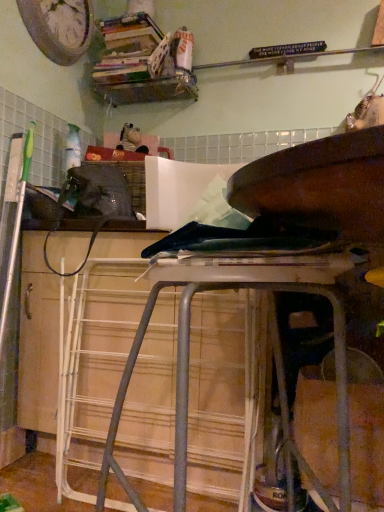
You are a GUI agent. You are given a task and a screenshot of the screen. Output one action in this format:
    pyautogui.click(x=<x>, y=<y>)
    Task: Click on the metallic silver stool at center
    The height and width of the screenshot is (512, 384).
    Given the screenshot: What is the action you would take?
    pyautogui.click(x=273, y=264)

What do you see at coordinates (143, 63) in the screenshot? I see `wooden bookshelf at upper center` at bounding box center [143, 63].

What do you see at coordinates (59, 27) in the screenshot?
I see `wooden clock at upper left` at bounding box center [59, 27].

Where is `metallic silver stool at center`? Image resolution: width=384 pixels, height=512 pixels. metallic silver stool at center is located at coordinates (273, 264).

Considering the sizes of objects wooden bookshelf at upper center and metallic silver stool at center in the image provided, who is taller, wooden bookshelf at upper center or metallic silver stool at center?

Standing taller between the two is metallic silver stool at center.

How far apart are wooden bookshelf at upper center and metallic silver stool at center?

1.33 meters.

Is the depth of wooden bookshelf at upper center less than that of metallic silver stool at center?

No, it is not.

From the image's perspective, is wooden bookshelf at upper center beneath metallic silver stool at center?

No, from the image's perspective, wooden bookshelf at upper center is not below metallic silver stool at center.

Which is closer to the camera, (60, 31) or (159, 282)?

Point (60, 31).

How different are the orientations of wooden clock at upper left and metallic silver stool at center in degrees?

The facing directions of wooden clock at upper left and metallic silver stool at center are 89.6 degrees apart.

From the image's perspective, is wooden clock at upper left under metallic silver stool at center?

Actually, wooden clock at upper left appears above metallic silver stool at center in the image.

Where is `shelf that appears behind the wooden clock at upper left`? Image resolution: width=384 pixels, height=512 pixels. shelf that appears behind the wooden clock at upper left is located at coordinates (143, 63).

Does wooden clock at upper left touch wooden bookshelf at upper center?

wooden clock at upper left is not next to wooden bookshelf at upper center, and they're not touching.

Considering the sizes of metallic silver stool at center and wooden clock at upper left in the image, is metallic silver stool at center bigger or smaller than wooden clock at upper left?

In the image, metallic silver stool at center appears to be larger than wooden clock at upper left.

Is metallic silver stool at center to the right of wooden clock at upper left from the viewer's perspective?

Yes.

Is metallic silver stool at center thinner than wooden clock at upper left?

Incorrect, the width of metallic silver stool at center is not less than that of wooden clock at upper left.

Do you think metallic silver stool at center is within wooden clock at upper left, or outside of it?

metallic silver stool at center is outside wooden clock at upper left.

Based on the photo, between wooden bookshelf at upper center and wooden clock at upper left, which one has less height?

Standing shorter between the two is wooden bookshelf at upper center.

Which is farther from the camera, (124, 91) or (22, 2)?

The point (124, 91) is behind.

Is wooden bookshelf at upper center not within wooden clock at upper left?

Yes, wooden bookshelf at upper center is located beyond the bounds of wooden clock at upper left.

Would you say metallic silver stool at center is inside or outside wooden bookshelf at upper center?

metallic silver stool at center is spatially situated outside wooden bookshelf at upper center.

Would you say metallic silver stool at center is a long distance from wooden bookshelf at upper center?

Yes, metallic silver stool at center and wooden bookshelf at upper center are located far from each other.

In the scene shown: Is metallic silver stool at center facing away from wooden bookshelf at upper center?

No, wooden bookshelf at upper center is not at the back of metallic silver stool at center.

Locate an element on the screen. The height and width of the screenshot is (512, 384). shelf lying on the left of metallic silver stool at center is located at coordinates (143, 63).

Locate an element on the screen. The width and height of the screenshot is (384, 512). furniture on the right of wooden clock at upper left is located at coordinates (273, 264).

When comparing their distances from wooden bookshelf at upper center, does wooden clock at upper left or metallic silver stool at center seem closer?

The object closer to wooden bookshelf at upper center is wooden clock at upper left.

Based on their spatial positions, is wooden clock at upper left or wooden bookshelf at upper center further from metallic silver stool at center?

wooden clock at upper left.

Which object lies nearer to the anchor point wooden clock at upper left, wooden bookshelf at upper center or metallic silver stool at center?

The object closer to wooden clock at upper left is wooden bookshelf at upper center.

When comparing their distances from metallic silver stool at center, does wooden bookshelf at upper center or wooden clock at upper left seem closer?

The object closer to metallic silver stool at center is wooden bookshelf at upper center.

Based on their spatial positions, is metallic silver stool at center or wooden bookshelf at upper center closer to wooden clock at upper left?

Among the two, wooden bookshelf at upper center is located nearer to wooden clock at upper left.

From the picture: From the image, which object appears to be farther from wooden bookshelf at upper center, metallic silver stool at center or wooden clock at upper left?

Among the two, metallic silver stool at center is located further to wooden bookshelf at upper center.

Where is `clock between metallic silver stool at center and wooden bookshelf at upper center along the z-axis`? The image size is (384, 512). clock between metallic silver stool at center and wooden bookshelf at upper center along the z-axis is located at coordinates (59, 27).